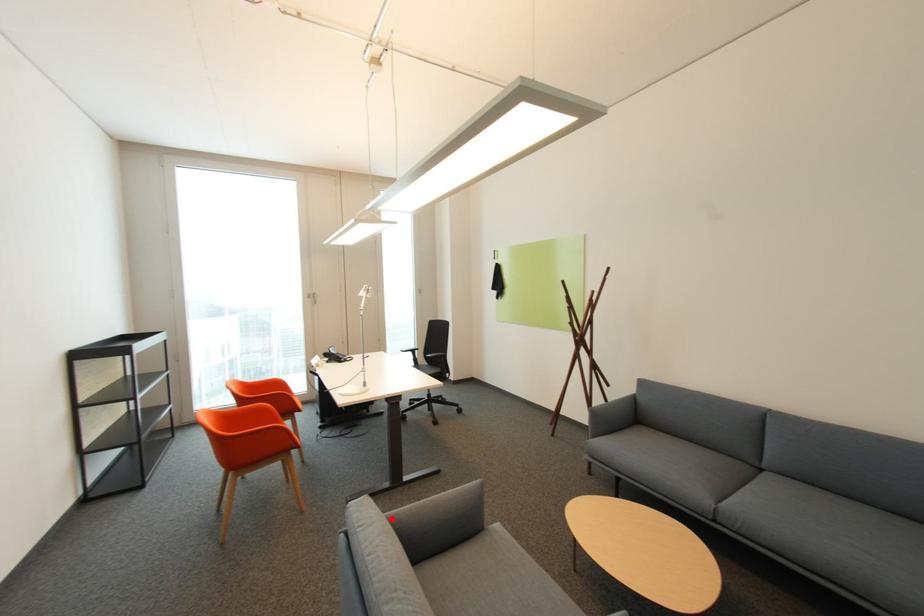
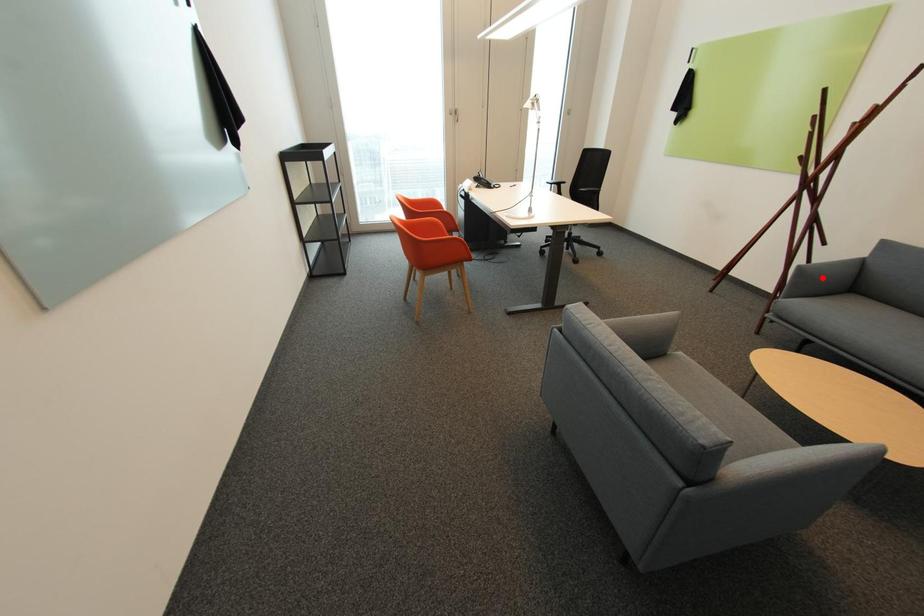
I am providing you with two images of the same scene from different viewpoints. A red point is marked on the first image and another point is marked on the second image. Is the red point in image1 aligned with the point shown in image2?

No